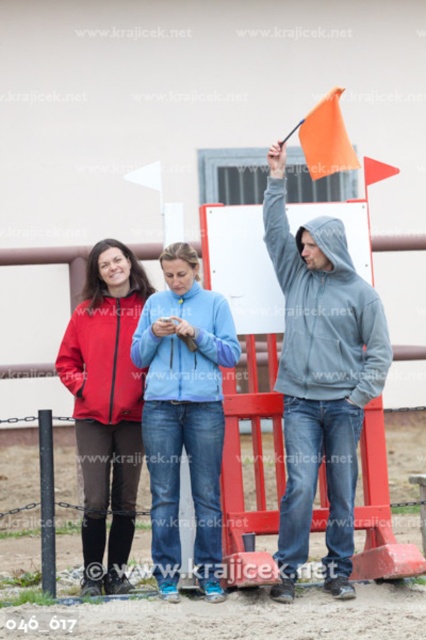
Question: Is light blue fleece jacket at center above light blue fleece at center?

Choices:
 (A) yes
 (B) no

Answer: (A)

Question: Which point is closer to the camera taking this photo?

Choices:
 (A) (311, 396)
 (B) (126, 362)
 (C) (279, 554)

Answer: (C)

Question: Is light blue fleece jacket at center closer to the viewer compared to matte red sweatshirt at center?

Choices:
 (A) yes
 (B) no

Answer: (A)

Question: Among these objects, which one is nearest to the camera?

Choices:
 (A) gray hoodie at center
 (B) matte red jacket at left
 (C) matte red sweatshirt at center

Answer: (A)

Question: Does gray hoodie at center have a larger size compared to orange fabric flag at upper right?

Choices:
 (A) no
 (B) yes

Answer: (B)

Question: Which object is the farthest from the matte red sweatshirt at center?

Choices:
 (A) orange fabric flag at upper right
 (B) matte red jacket at left

Answer: (A)